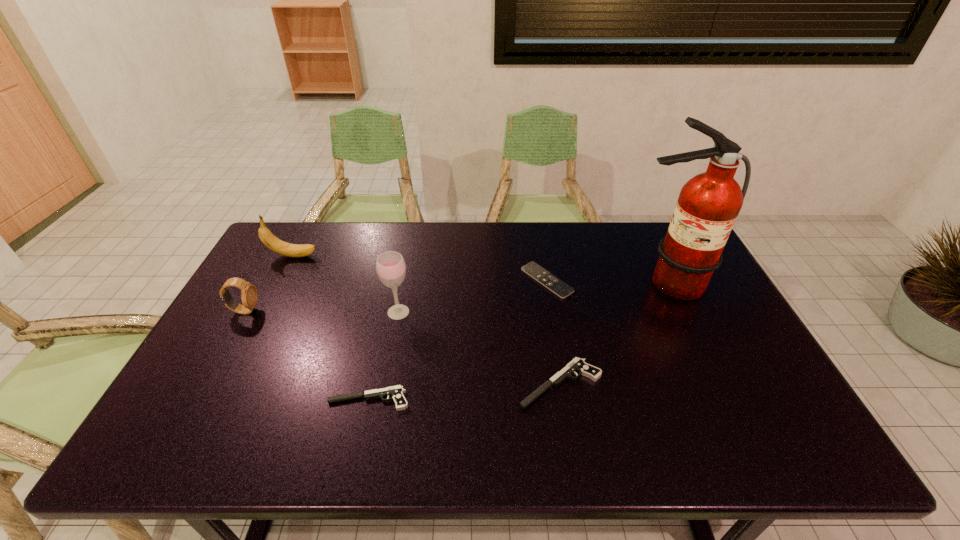
Find the location of a particular element. the tallest object is located at coordinates [x=708, y=205].

Identify the location of vacant space located on the front-facing side of the shorter pistol. The width and height of the screenshot is (960, 540). (180, 399).

Locate an element on the screen. The width and height of the screenshot is (960, 540). vacant space located on the front-facing side of the shorter pistol is located at coordinates (275, 399).

At what (x,y) coordinates should I click in order to perform the action: click on vacant space situated 0.100m on the front-facing side of the shorter pistol. Please return your answer as a coordinate pair (x, y). Looking at the image, I should click on (287, 399).

The height and width of the screenshot is (540, 960). Find the location of `free space located on the front-facing side of the third shortest object`. free space located on the front-facing side of the third shortest object is located at coordinates (372, 384).

Locate an element on the screen. free space located on the front-facing side of the third shortest object is located at coordinates (405, 384).

Identify the location of free space located on the front-facing side of the third shortest object. The width and height of the screenshot is (960, 540). (429, 384).

Locate an element on the screen. free point located at the start of the peel on the fifth shortest object is located at coordinates (343, 256).

Where is `free space located 0.080m on the face of the fourth tallest object`? free space located 0.080m on the face of the fourth tallest object is located at coordinates coord(286,310).

This screenshot has width=960, height=540. In order to click on vacant area situated 0.260m on the left of the wineglass in this screenshot , I will do `click(296, 312)`.